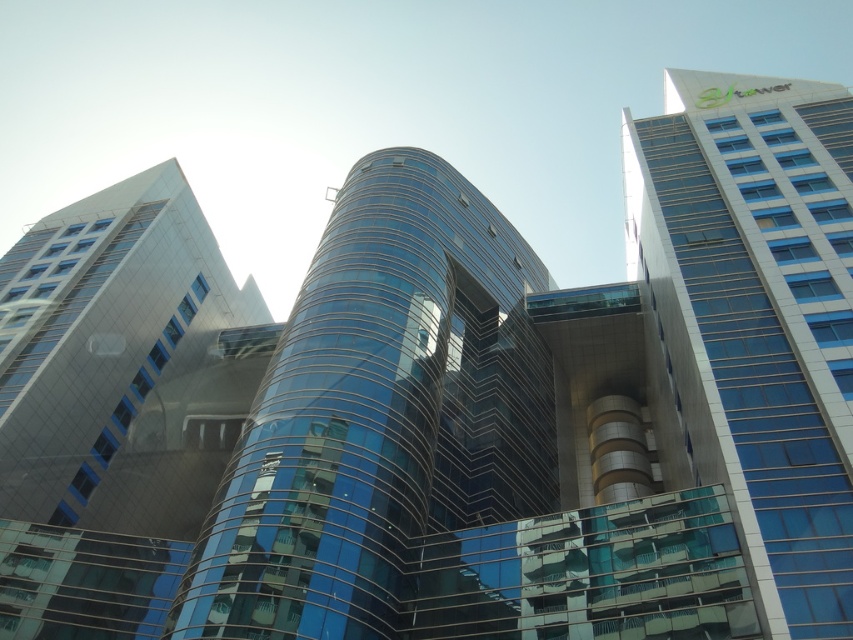
How distant is shiny glass tower at center from transparent glass building at center?

The distance of shiny glass tower at center from transparent glass building at center is 24.33 meters.

Is shiny glass tower at center wider than transparent glass building at center?

No.

Is point (186, 620) positioned after point (149, 522)?

That is False.

Where is `shiny glass tower at center`? shiny glass tower at center is located at coordinates (380, 413).

Is blue glass building at upper right below transparent glass building at center?

No, blue glass building at upper right is not below transparent glass building at center.

Who is positioned more to the left, blue glass building at upper right or transparent glass building at center?

Positioned to the left is transparent glass building at center.

The image size is (853, 640). Describe the element at coordinates (757, 316) in the screenshot. I see `blue glass building at upper right` at that location.

Find the location of `blue glass building at upper right`. blue glass building at upper right is located at coordinates (757, 316).

Is shiny glass tower at center to the left of blue glass building at upper right from the viewer's perspective?

Yes, shiny glass tower at center is to the left of blue glass building at upper right.

Does shiny glass tower at center have a smaller size compared to blue glass building at upper right?

Yes.

What do you see at coordinates (380, 413) in the screenshot?
I see `shiny glass tower at center` at bounding box center [380, 413].

Image resolution: width=853 pixels, height=640 pixels. What are the coordinates of `shiny glass tower at center` in the screenshot? It's located at (380, 413).